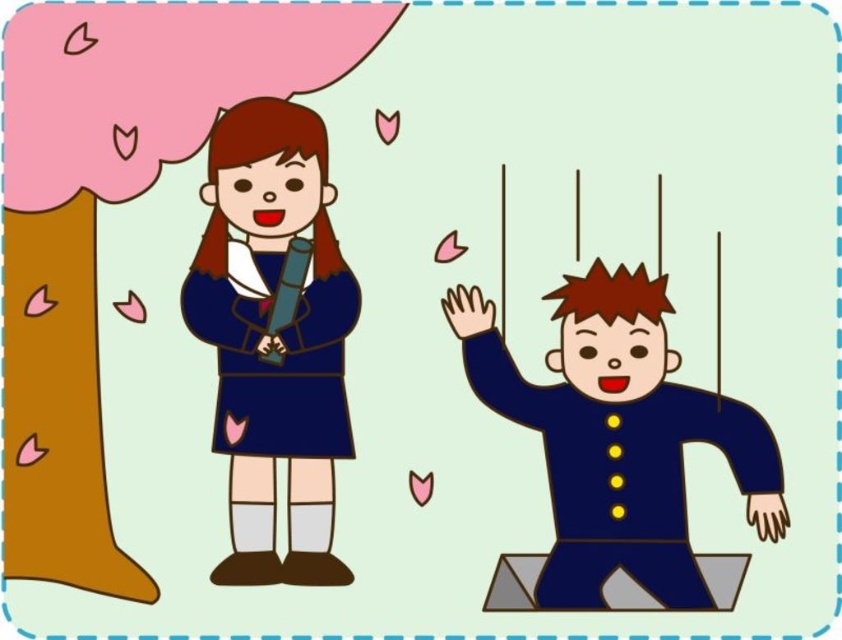
Question: Is matte blue dress at center closer to camera compared to matte blue uniform at right?

Choices:
 (A) yes
 (B) no

Answer: (B)

Question: Which point is farther to the camera?

Choices:
 (A) matte blue dress at center
 (B) matte blue uniform at right

Answer: (A)

Question: Is matte blue dress at center closer to the viewer compared to matte blue uniform at right?

Choices:
 (A) no
 (B) yes

Answer: (A)

Question: Which point is closer to the camera?

Choices:
 (A) matte blue uniform at right
 (B) matte blue dress at center

Answer: (A)

Question: Can you confirm if matte blue dress at center is thinner than matte blue uniform at right?

Choices:
 (A) no
 (B) yes

Answer: (B)